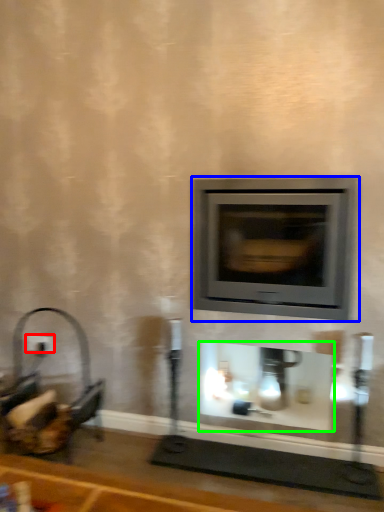
Question: Which is farther away from electric outlet (highlighted by a red box)? wood burning stove (highlighted by a blue box) or fireplace (highlighted by a green box)?

Choices:
 (A) wood burning stove
 (B) fireplace

Answer: (A)